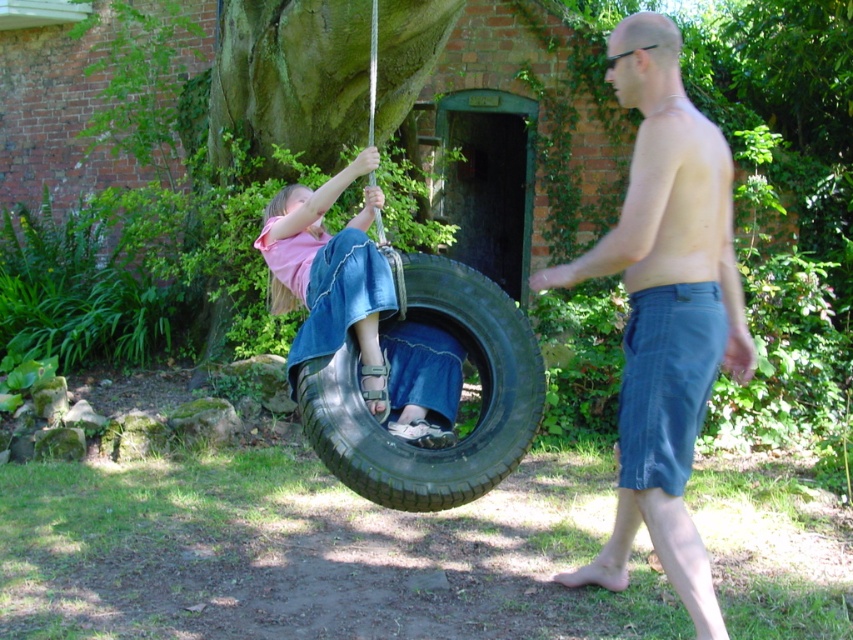
Question: Which of the following is the farthest from the observer?

Choices:
 (A) blue denim shorts at right
 (B) denim skirt at center
 (C) black rubber tire at center

Answer: (B)

Question: Which object appears closest to the camera in this image?

Choices:
 (A) blue denim shorts at right
 (B) denim skirt at center

Answer: (A)

Question: Is black rubber tire at center wider than denim skirt at center?

Choices:
 (A) yes
 (B) no

Answer: (A)

Question: Which of the following is the closest to the observer?

Choices:
 (A) (712, 358)
 (B) (425, 500)

Answer: (A)

Question: Does black rubber tire at center have a larger size compared to denim skirt at center?

Choices:
 (A) yes
 (B) no

Answer: (B)

Question: Is blue denim shorts at right thinner than denim skirt at center?

Choices:
 (A) yes
 (B) no

Answer: (A)